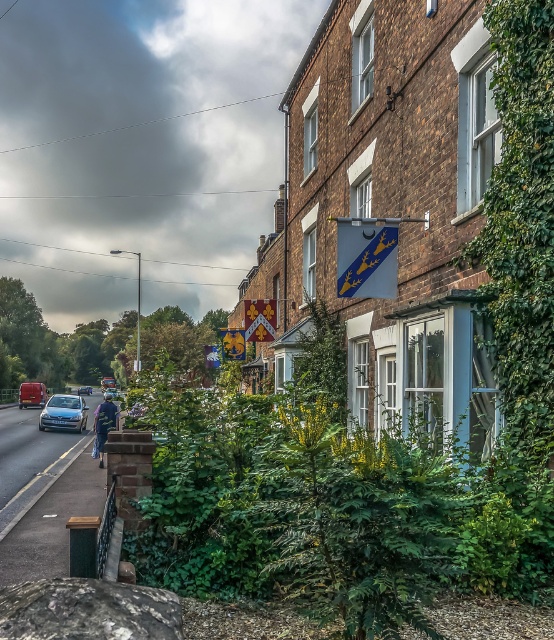
Consider the image. You are a delivery driver who needs to park your vehicle in this area. There is a satin silver sedan at lower left. Based on its position, can you determine if there is enough space to park your truck, which is 6 meters long, next to it without overlapping?

The satin silver sedan at lower left is located at point (64,412). However, without knowing the exact dimensions of the parking area or the distance between the sedan and nearby obstacles, it is impossible to determine if there is sufficient space to park a 6 meter long truck next to it without overlapping.

You are a delivery person who needs to park your vehicle between the metallic silver van at left and the silver metallic car at center. The parking space between them is exactly 2 meters wide. Your delivery truck is 2.2 meters wide. Can you fit your truck into this space?

The metallic silver van at left has a lesser width compared to silver metallic car at center. However, the parking space between them is only 2 meters wide, which is narrower than your 2.2 meter wide truck. Therefore, your truck cannot fit into this space.

You are a pedestrian standing at the edge of the road and see the satin silver sedan at lower left and the silver metallic car at center. Which car is closer to your right side?

The satin silver sedan at lower left is to the right of the silver metallic car at center, so the satin silver sedan at lower left is closer to your right side.